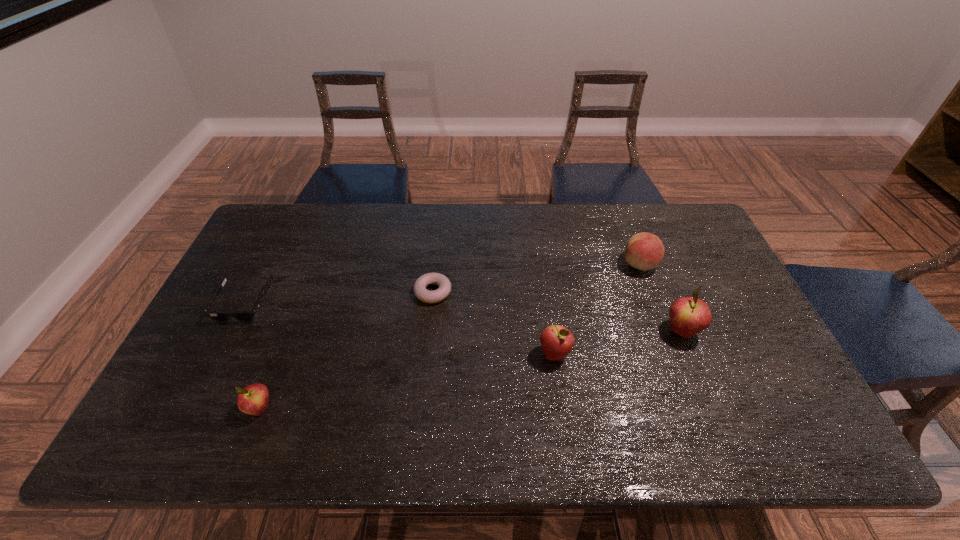
I want to click on the leftmost apple, so click(253, 399).

You are a GUI agent. You are given a task and a screenshot of the screen. Output one action in this format:
    pyautogui.click(x=<x>, y=<y>)
    Task: Click on the nearest apple
    The height and width of the screenshot is (540, 960).
    Given the screenshot: What is the action you would take?
    pyautogui.click(x=253, y=399)

Locate an element on the screen. the second apple from left to right is located at coordinates (556, 341).

At what (x,y) coordinates should I click in order to perform the action: click on the second tallest apple. Please return your answer as a coordinate pair (x, y). Image resolution: width=960 pixels, height=540 pixels. Looking at the image, I should click on (556, 341).

Where is `the tallest object`? The image size is (960, 540). the tallest object is located at coordinates (688, 315).

The height and width of the screenshot is (540, 960). Find the location of `the tallest apple`. the tallest apple is located at coordinates (688, 315).

The image size is (960, 540). I want to click on the leftmost object, so click(x=243, y=316).

This screenshot has width=960, height=540. I want to click on the farthest object, so click(x=645, y=251).

I want to click on doughnut, so click(420, 285).

I want to click on the third object from left to right, so click(x=420, y=285).